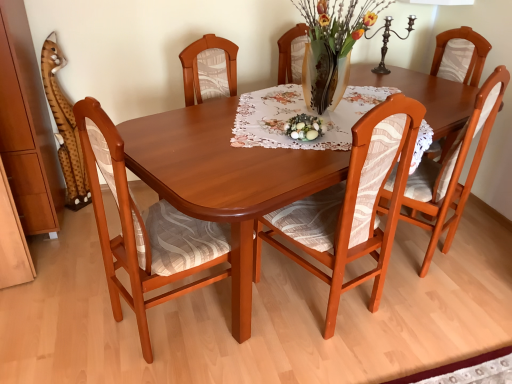
Find the location of a particular element. The height and width of the screenshot is (384, 512). unoccupied area behind matte green glass bowl at center is located at coordinates (297, 114).